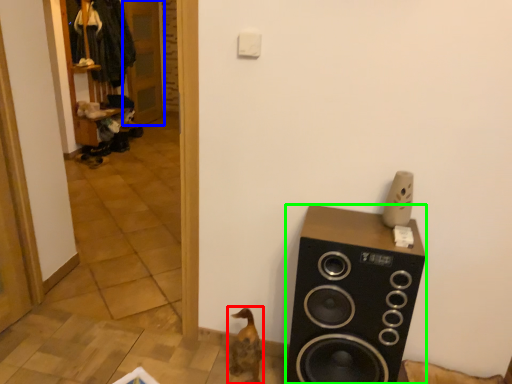
Question: Considering the real-world distances, which object is closest to animal (highlighted by a red box)? door (highlighted by a blue box) or speaker (highlighted by a green box).

Choices:
 (A) door
 (B) speaker

Answer: (B)